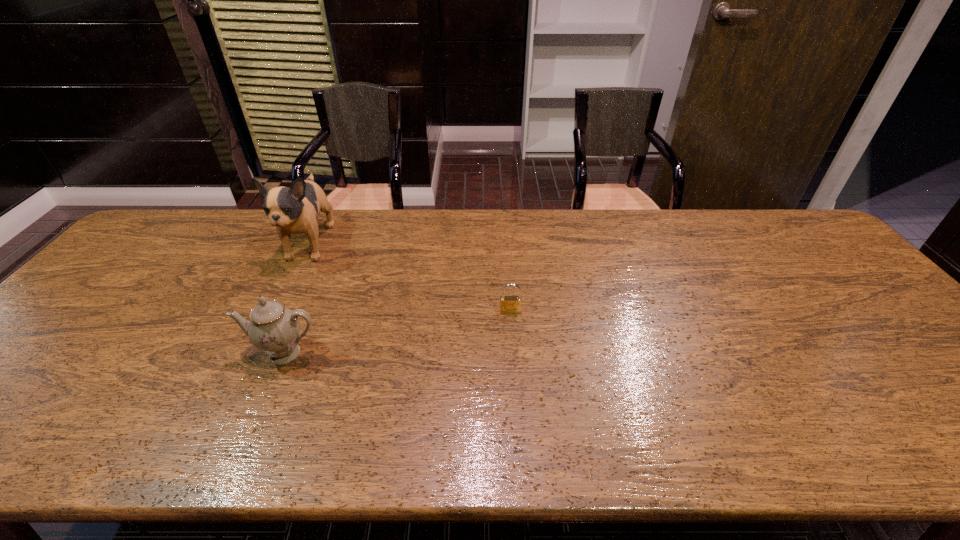
Locate an element on the screen. This screenshot has width=960, height=540. the tallest object is located at coordinates (295, 210).

Identify the location of the farthest object. (295, 210).

I want to click on chinaware, so pos(273,329).

At what (x,y) coordinates should I click in order to perform the action: click on the nearest object. Please return your answer as a coordinate pair (x, y). Looking at the image, I should click on (273, 329).

You are a GUI agent. You are given a task and a screenshot of the screen. Output one action in this format:
    pyautogui.click(x=<x>, y=<y>)
    Task: Click on the second farthest object
    The width and height of the screenshot is (960, 540).
    Given the screenshot: What is the action you would take?
    pyautogui.click(x=508, y=304)

Identify the location of padlock. (508, 304).

Identify the location of free space located at the face of the tallest object. (269, 329).

Find the location of a particular element. This screenshot has height=540, width=960. vacant space situated on the spout of the nearest object is located at coordinates (248, 440).

Locate an element on the screen. vacant point located 0.100m on the front-facing side of the padlock is located at coordinates (513, 342).

The image size is (960, 540). Find the location of `object that is at the far edge`. object that is at the far edge is located at coordinates (295, 210).